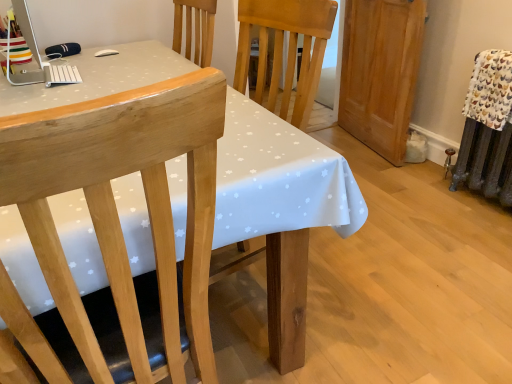
Question: Is white dotted fabric at center to the left of natural wood chair at left from the viewer's perspective?

Choices:
 (A) yes
 (B) no

Answer: (A)

Question: Are white dotted fabric at center and natural wood chair at left making contact?

Choices:
 (A) no
 (B) yes

Answer: (A)

Question: From a real-world perspective, is white dotted fabric at center located beneath natural wood chair at left?

Choices:
 (A) yes
 (B) no

Answer: (A)

Question: Is white dotted fabric at center to the right of natural wood chair at left from the viewer's perspective?

Choices:
 (A) no
 (B) yes

Answer: (A)

Question: Considering the relative sizes of white dotted fabric at center and natural wood chair at left in the image provided, is white dotted fabric at center thinner than natural wood chair at left?

Choices:
 (A) no
 (B) yes

Answer: (A)

Question: From their relative heights in the image, would you say light brown wood armoire at right is taller or shorter than natural wood chair at left?

Choices:
 (A) tall
 (B) short

Answer: (B)

Question: Is light brown wood armoire at right inside the boundaries of natural wood chair at left, or outside?

Choices:
 (A) outside
 (B) inside

Answer: (A)

Question: Is light brown wood armoire at right bigger or smaller than natural wood chair at left?

Choices:
 (A) big
 (B) small

Answer: (B)

Question: Does point (367, 51) appear closer or farther from the camera than point (2, 127)?

Choices:
 (A) closer
 (B) farther

Answer: (B)

Question: Is white dotted fabric at center wider or thinner than natural wood chair at left?

Choices:
 (A) thin
 (B) wide

Answer: (B)

Question: Is white dotted fabric at center inside the boundaries of natural wood chair at left, or outside?

Choices:
 (A) outside
 (B) inside

Answer: (A)

Question: Is white dotted fabric at center in front of or behind natural wood chair at left in the image?

Choices:
 (A) front
 (B) behind

Answer: (B)

Question: Is white dotted fabric at center to the left or to the right of natural wood chair at left in the image?

Choices:
 (A) left
 (B) right

Answer: (A)

Question: Is white plastic desktop computer at upper left taller or shorter than white fabric with chicken print at right?

Choices:
 (A) short
 (B) tall

Answer: (A)

Question: Looking at the image, does white plastic desktop computer at upper left seem bigger or smaller compared to white fabric with chicken print at right?

Choices:
 (A) small
 (B) big

Answer: (B)